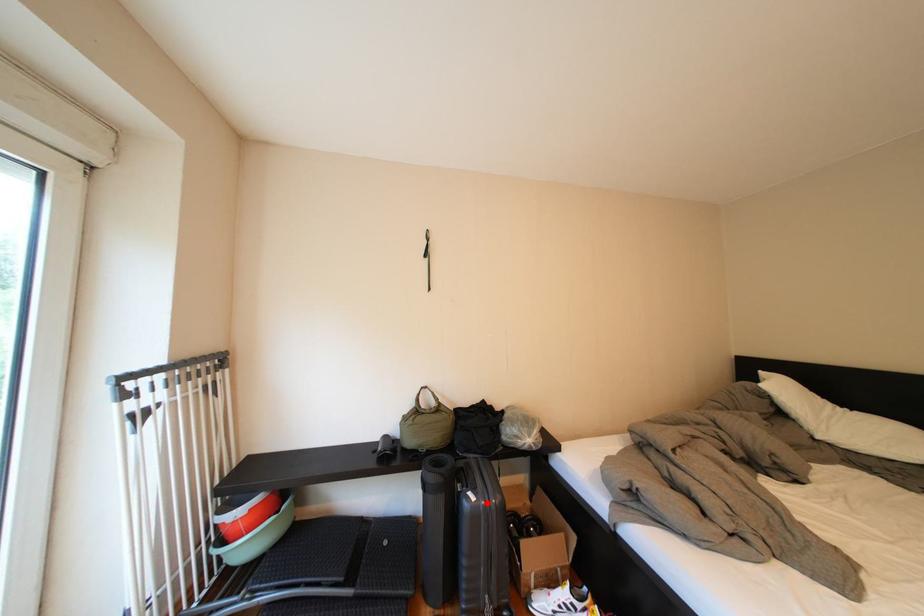
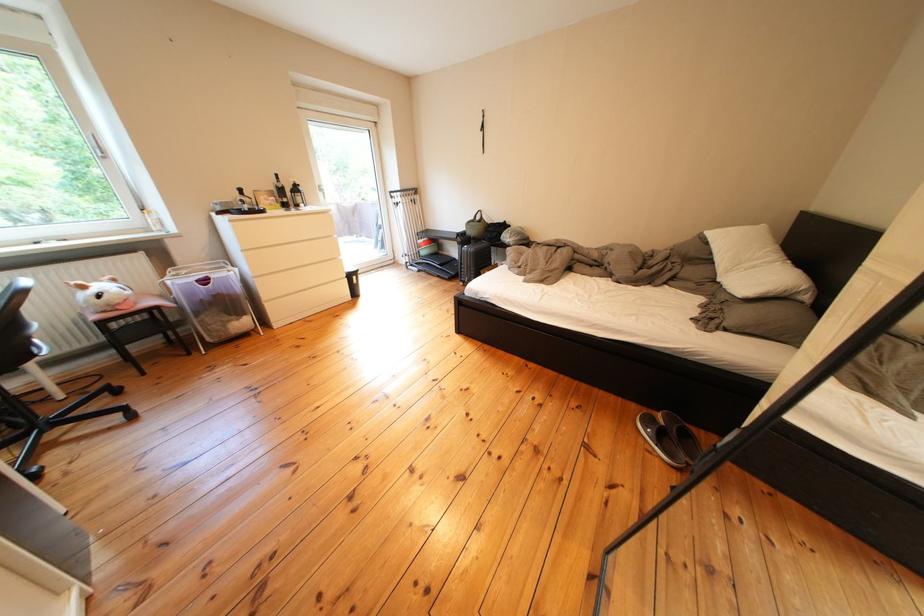
Find the pixel in the second image that matches the highlighted location in the first image.

(479, 252)